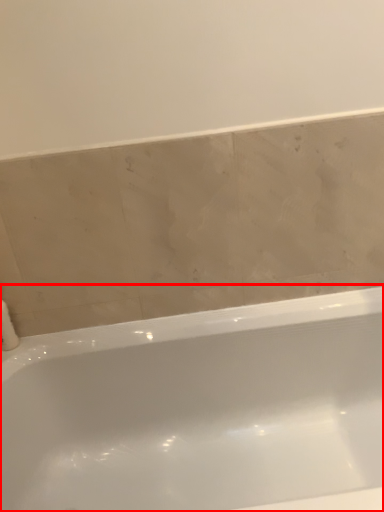
Question: From the image, what is the correct spatial relationship of bathtub (annotated by the red box) in relation to toilet paper?

Choices:
 (A) right
 (B) left

Answer: (A)